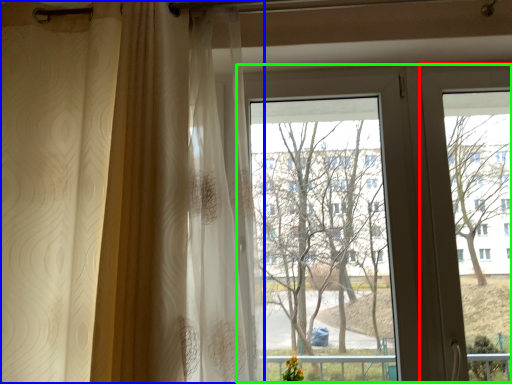
Question: Based on their relative distances, which object is farther from screen door (highlighted by a red box)? Choose from curtain (highlighted by a blue box) and bay window (highlighted by a green box).

Choices:
 (A) curtain
 (B) bay window

Answer: (A)